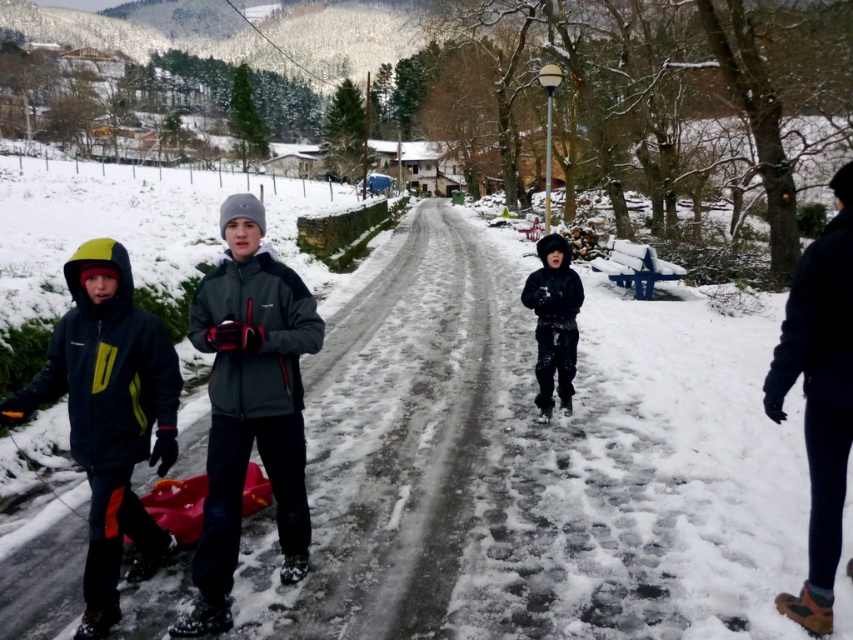
Measure the distance between point (258, 321) and camera.

3.90 meters

Does matte gray jacket at center lie behind dark blue fabric pants at right?

Yes, matte gray jacket at center is behind dark blue fabric pants at right.

What do you see at coordinates (248, 404) in the screenshot? Image resolution: width=853 pixels, height=640 pixels. I see `matte gray jacket at center` at bounding box center [248, 404].

In order to click on matte gray jacket at center in this screenshot , I will do pos(248,404).

Can you confirm if dark blue fabric pants at right is taller than black matte snowsuit at center?

Indeed, dark blue fabric pants at right has a greater height compared to black matte snowsuit at center.

Between dark blue fabric pants at right and black matte snowsuit at center, which one appears on the left side from the viewer's perspective?

Positioned to the left is black matte snowsuit at center.

Find the location of a particular element. dark blue fabric pants at right is located at coordinates click(x=819, y=396).

Is point (109, 465) positioned before point (553, 355)?

Yes, point (109, 465) is in front of point (553, 355).

Is point (82, 456) behind point (544, 296)?

No, it is not.

Who is more distant from viewer, (115, 570) or (569, 276)?

Positioned behind is point (569, 276).

This screenshot has height=640, width=853. I want to click on black matte jacket at left, so click(109, 417).